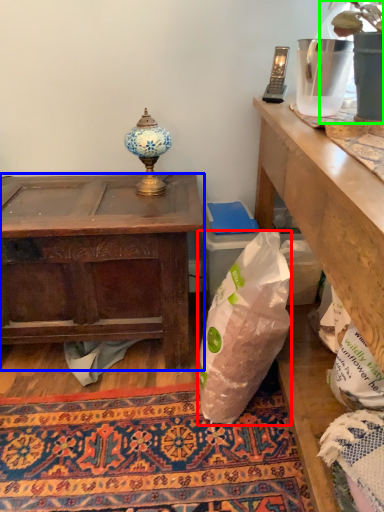
Question: Which object is positioned closest to plastic bag (highlighted by a red box)? Select from desk (highlighted by a blue box) and houseplant (highlighted by a green box).

Choices:
 (A) desk
 (B) houseplant

Answer: (A)